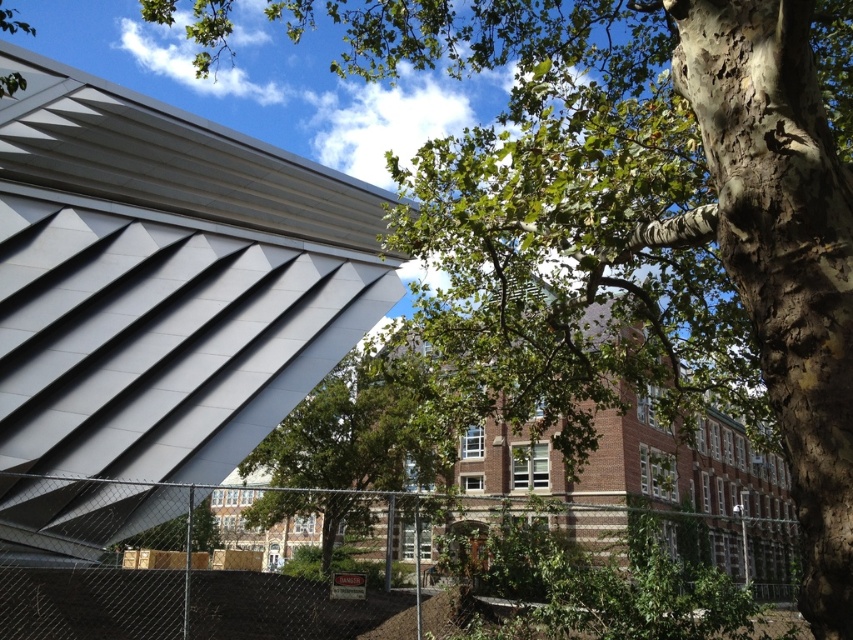
You are standing in front of a modern building with a geometric roof and a traditional brick building. You notice two points marked on the scene at coordinates point (112, 177) and point (788, 634). Which point is closer to you?

Point (112, 177) is further to the viewer than point (788, 634), so the closer point to you is point (788, 634).

You are an architect analyzing the spatial relationship between the metallic silver roof at upper left and the green leafy tree at center. Which object is closer to the viewer in this scene?

The metallic silver roof at upper left is closer to the viewer than the green leafy tree at center.